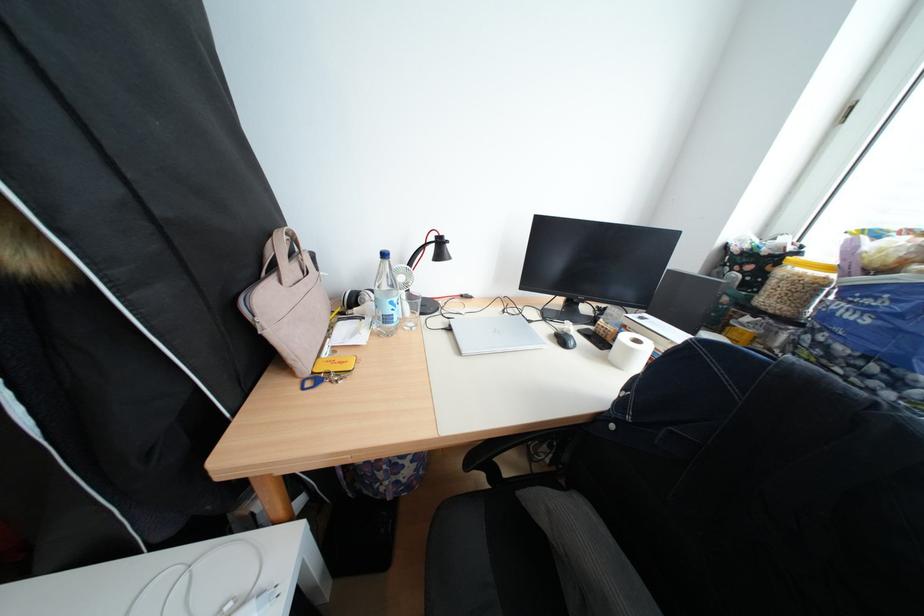
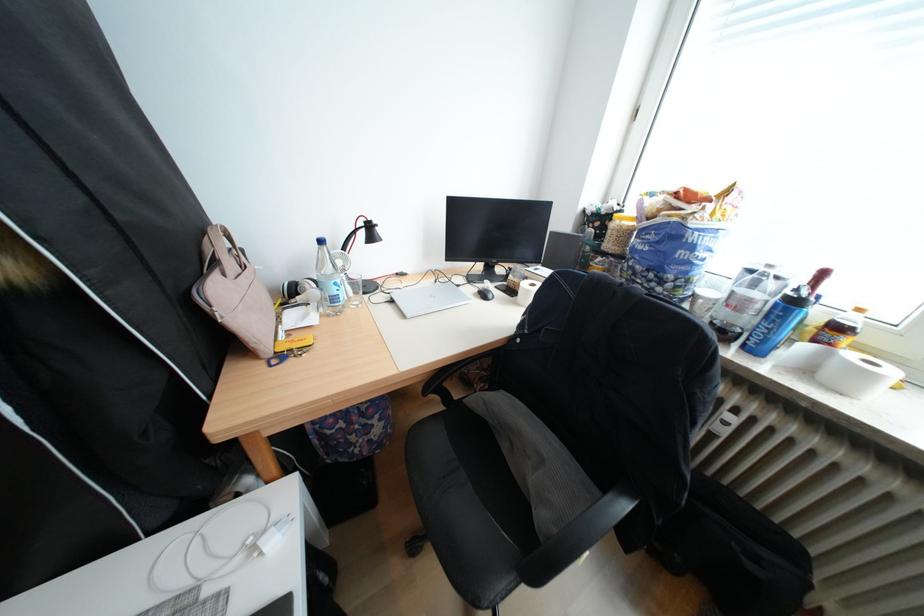
Locate, in the second image, the point that corresponds to pixel 506 474 in the first image.

(458, 398)